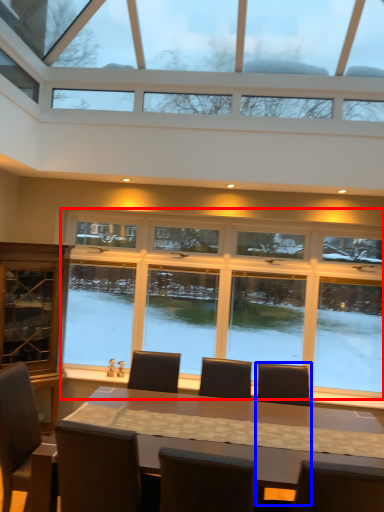
Question: Among these objects, which one is nearest to the camera, window (highlighted by a red box) or armchair (highlighted by a blue box)?

Choices:
 (A) window
 (B) armchair

Answer: (B)